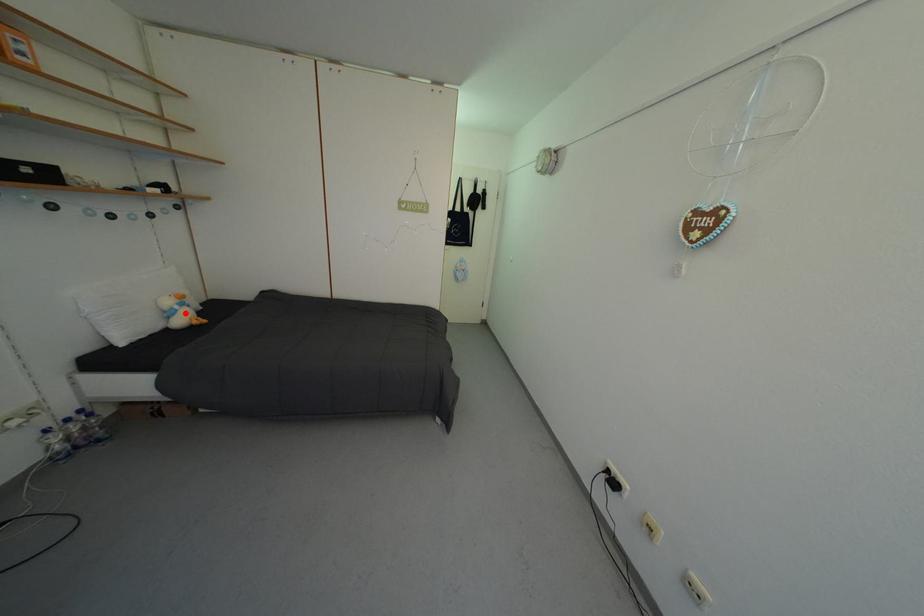
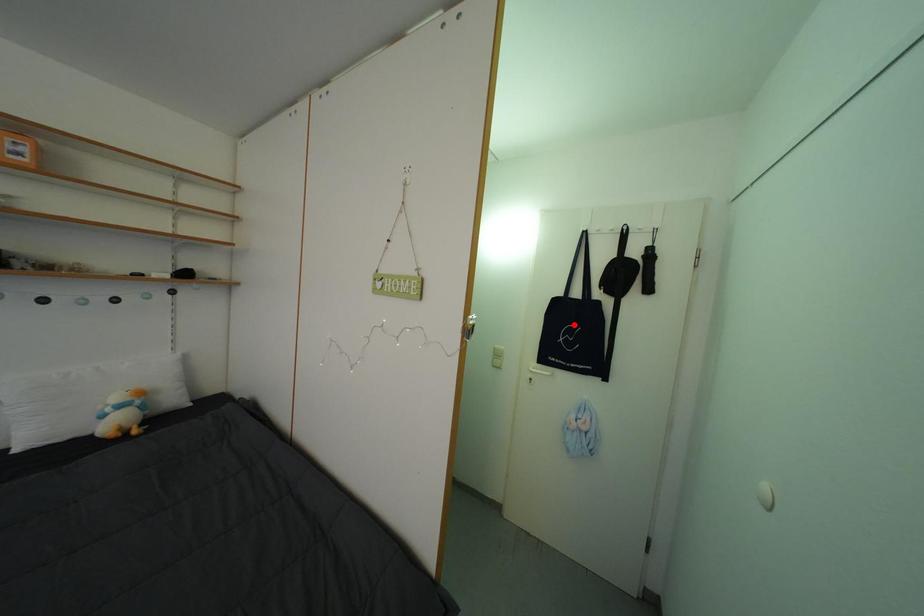
I am providing you with two images of the same scene from different viewpoints. A red point is marked on the first image and another point is marked on the second image. Is the red point in image1 aligned with the point shown in image2?

No